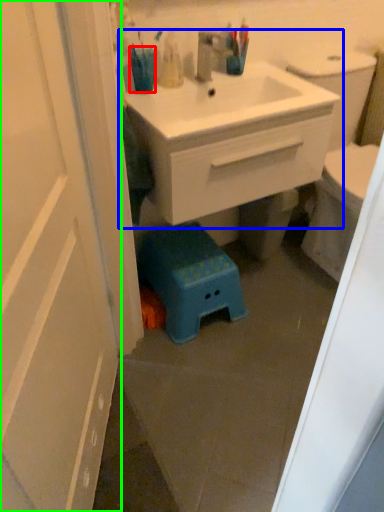
Question: Considering the real-world distances, which object is closest to teal (highlighted by a red box)? bathroom cabinet (highlighted by a blue box) or door (highlighted by a green box).

Choices:
 (A) bathroom cabinet
 (B) door

Answer: (A)